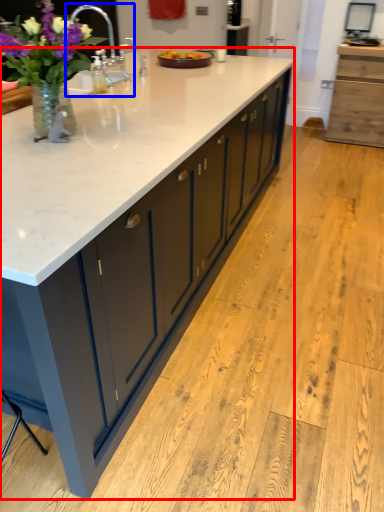
Question: Which point is closer to the camera, countertop (highlighted by a red box) or sink (highlighted by a blue box)?

Choices:
 (A) countertop
 (B) sink

Answer: (A)